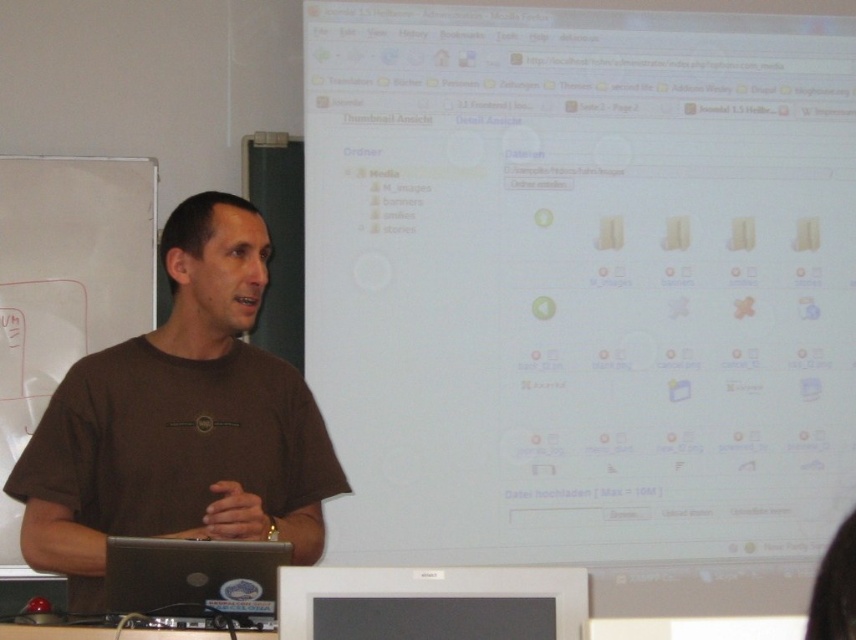
Is point (712, 577) in front of point (171, 541)?

No, it is not.

Does point (672, 344) come behind point (194, 541)?

Yes, point (672, 344) is behind point (194, 541).

What are the coordinates of `white glossy screen at upper center` in the screenshot? It's located at (586, 291).

Which of these two, white glossy screen at upper center or black glossy monitor at lower center, stands shorter?

black glossy monitor at lower center is shorter.

At what (x,y) coordinates should I click in order to perform the action: click on white glossy screen at upper center. Please return your answer as a coordinate pair (x, y). Looking at the image, I should click on (586, 291).

At what (x,y) coordinates should I click in order to perform the action: click on white glossy screen at upper center. Please return your answer as a coordinate pair (x, y). The height and width of the screenshot is (640, 856). Looking at the image, I should click on (586, 291).

Consider the image. Who is shorter, white glossy screen at upper center or brown cotton shirt at center?

Standing shorter between the two is brown cotton shirt at center.

Is white glossy screen at upper center positioned at the back of brown cotton shirt at center?

Yes.

Where is `white glossy screen at upper center`? Image resolution: width=856 pixels, height=640 pixels. white glossy screen at upper center is located at coordinates (586, 291).